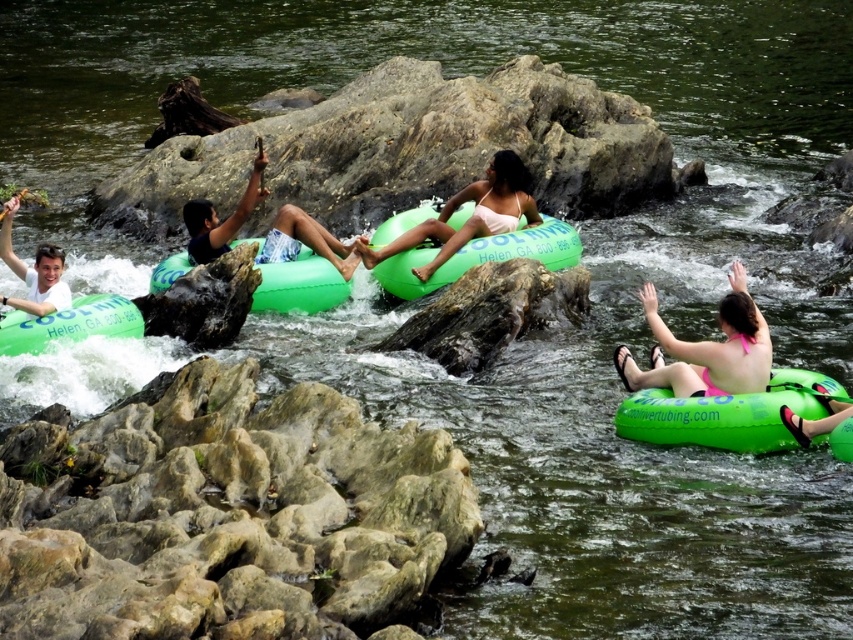
Looking at this image, you are a photographer positioned at the edge of the river, aiming to capture a photo of the rocky at center and the green rubber raft at center. Which object should you focus on first to ensure both are in sharp focus?

You should focus on the rocky at center first because it is closer to the viewer than the green rubber raft at center. By focusing on the closer object, the farther one will also be in focus due to the depth of field.

You are a photographer planning to take a group photo of the rocky at center and the green rubber raft at center. If you want to ensure both fit in the frame, which object should you position closer to the camera?

You should position the green rubber raft at center closer to the camera because the rocky at center is wider than the green rubber raft at center, so moving the smaller raft forward will help both fit within the frame.